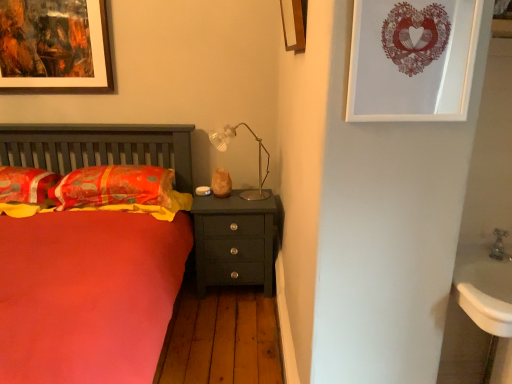
Where is `vacant space situated on the left part of gold metallic table lamp at center`? vacant space situated on the left part of gold metallic table lamp at center is located at coordinates coord(207,196).